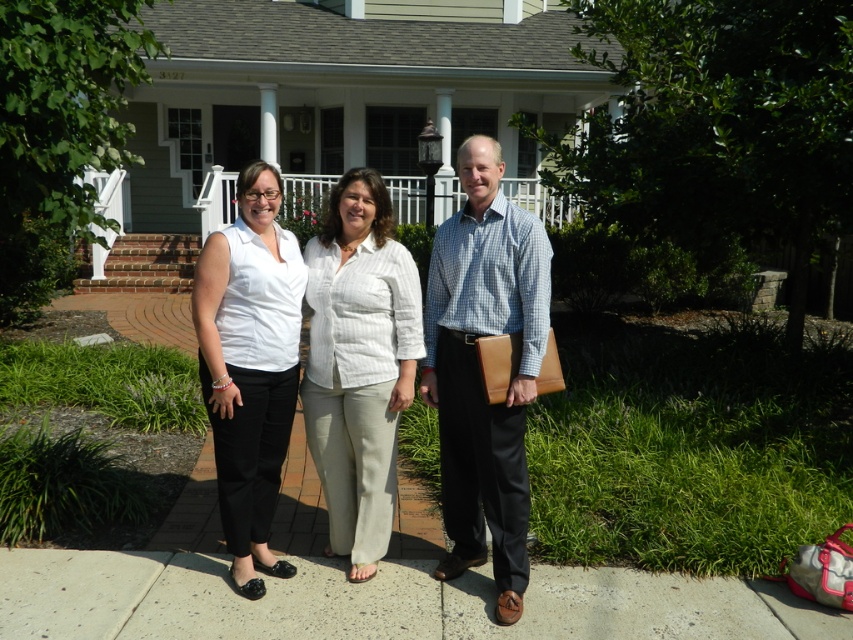
Question: Which point appears farthest from the camera in this image?

Choices:
 (A) (292, 324)
 (B) (527, 195)
 (C) (223, 595)

Answer: (B)

Question: In this image, where is matte white blouse at center located relative to white wooden porch at center?

Choices:
 (A) right
 (B) left

Answer: (B)

Question: Does white cotton shirt at center have a smaller size compared to blue checkered shirt at center?

Choices:
 (A) no
 (B) yes

Answer: (A)

Question: Is concrete at center below white textured pants at center?

Choices:
 (A) yes
 (B) no

Answer: (A)

Question: Which of the following is the closest to the observer?

Choices:
 (A) (502, 449)
 (B) (228, 301)
 (C) (30, 632)

Answer: (C)

Question: Based on their relative distances, which object is nearer to the white textured pants at center?

Choices:
 (A) matte white blouse at center
 (B) blue checkered shirt at center
 (C) white wooden porch at center

Answer: (A)